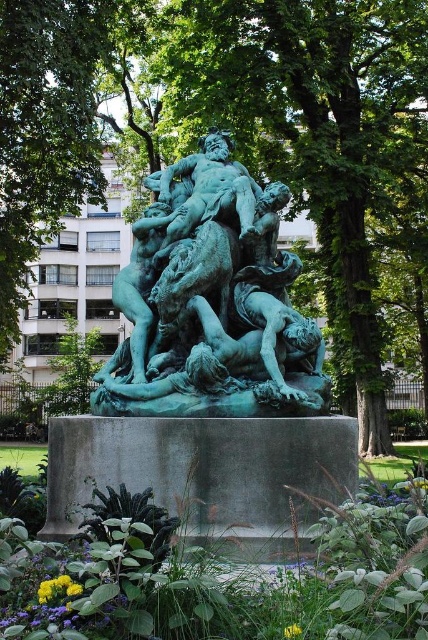
You are an art curator planning to move the green patina statue at center and the green stone statue at center to a new exhibition hall. The hall has a 5 meter wide entrance. Can both statues be moved through the entrance without rotating them?

The green patina statue at center is 4.92 meters away from green stone statue at center, so the distance between them is less than 5 meters. Therefore, both statues can be moved through the entrance without rotating them as their combined width would fit within the 5 meter width.